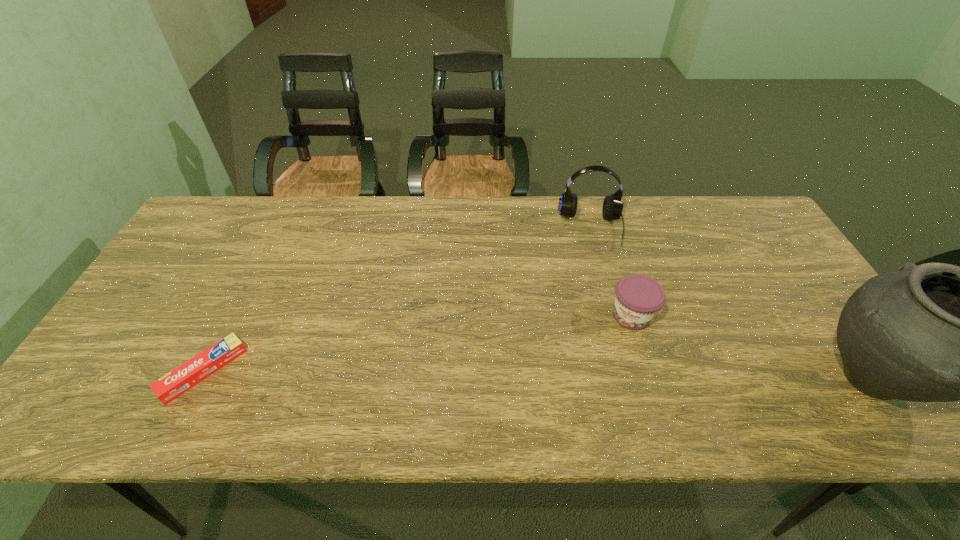
What are the coordinates of `vacant region located on the ear cushions of the headset` in the screenshot? It's located at (598, 301).

Where is `vacant position located 0.310m on the ear cushions of the headset`? The image size is (960, 540). vacant position located 0.310m on the ear cushions of the headset is located at coordinates (602, 334).

What are the coordinates of `object present at the far edge` in the screenshot? It's located at (612, 208).

At what (x,y) coordinates should I click in order to perform the action: click on object present at the near edge. Please return your answer as a coordinate pair (x, y). Looking at the image, I should click on (178, 381).

In the image, there is a desktop. Identify the location of vacant space at the far edge. The height and width of the screenshot is (540, 960). (439, 198).

This screenshot has width=960, height=540. Find the location of `free location at the near edge`. free location at the near edge is located at coordinates (237, 388).

Locate an element on the screen. free region at the left edge of the desktop is located at coordinates (200, 261).

In the image, there is a desktop. Where is `vacant space at the far left corner`? vacant space at the far left corner is located at coordinates (240, 229).

Image resolution: width=960 pixels, height=540 pixels. Find the location of `vacant space at the far right corner of the desktop`. vacant space at the far right corner of the desktop is located at coordinates (722, 229).

Locate an element on the screen. free spot between the jam and the second tallest object is located at coordinates (612, 272).